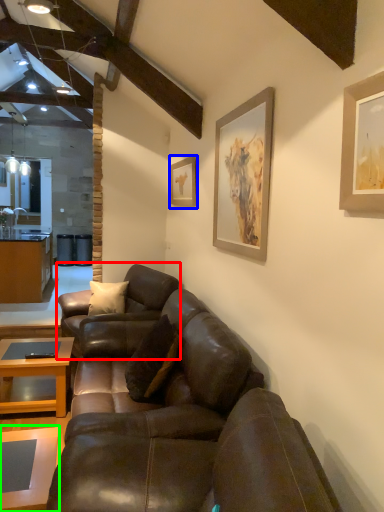
Question: Estimate the real-world distances between objects in this image. Which object is closer to studio couch (highlighted by a red box), picture frame (highlighted by a blue box) or coffee table (highlighted by a green box)?

Choices:
 (A) picture frame
 (B) coffee table

Answer: (A)